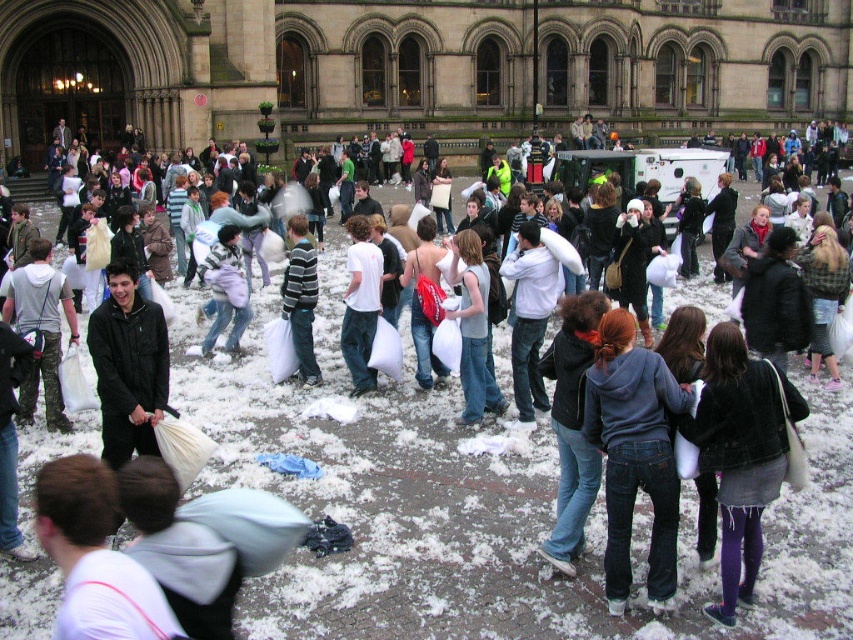
You are standing at the bottom left corner of the image. Looking towards the center, you see a point marked at coordinates point (634, 454). What object is located at that point?

The point (634, 454) corresponds to denim jeans at center.

You are a photographer standing in the snow and want to take a picture of the denim jacket at lower right and the striped sweater at center. Which clothing item will appear taller in the photo?

The striped sweater at center will appear taller in the photo because it is taller than the denim jacket at lower right.